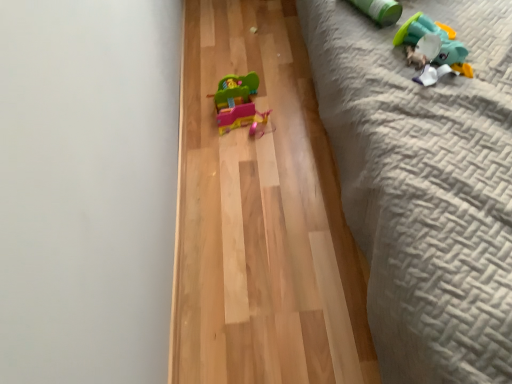
The width and height of the screenshot is (512, 384). In order to click on blank space to the left of matte plastic toy at center, the third toy positioned from the front in this screenshot , I will do `click(198, 114)`.